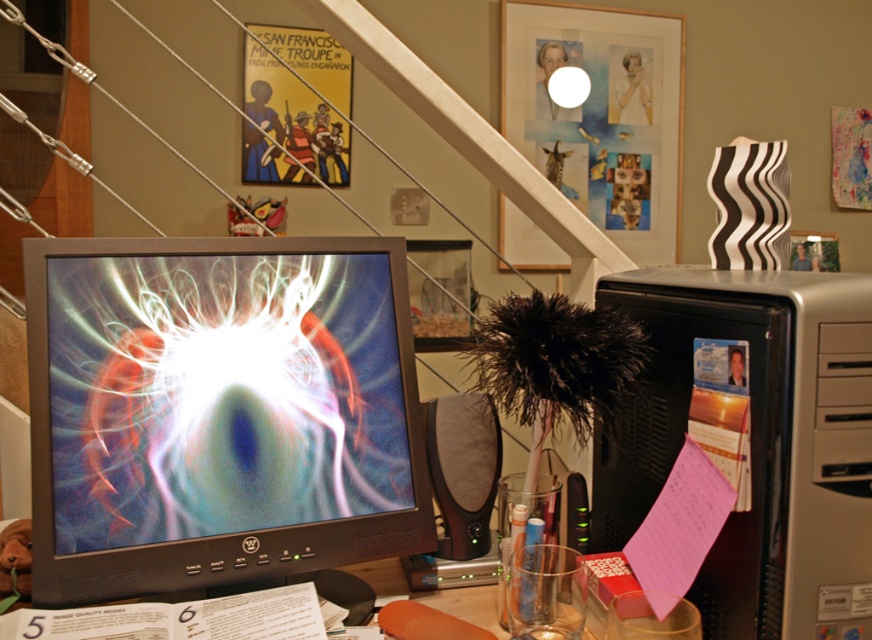
Does matte black monitor at center appear on the left side of silver metallic computer tower at right?

Indeed, matte black monitor at center is positioned on the left side of silver metallic computer tower at right.

Between point (148, 282) and point (763, 440), which one is positioned in front?

Positioned in front is point (763, 440).

What do you see at coordinates (218, 412) in the screenshot?
I see `matte black monitor at center` at bounding box center [218, 412].

This screenshot has width=872, height=640. I want to click on matte black monitor at center, so click(218, 412).